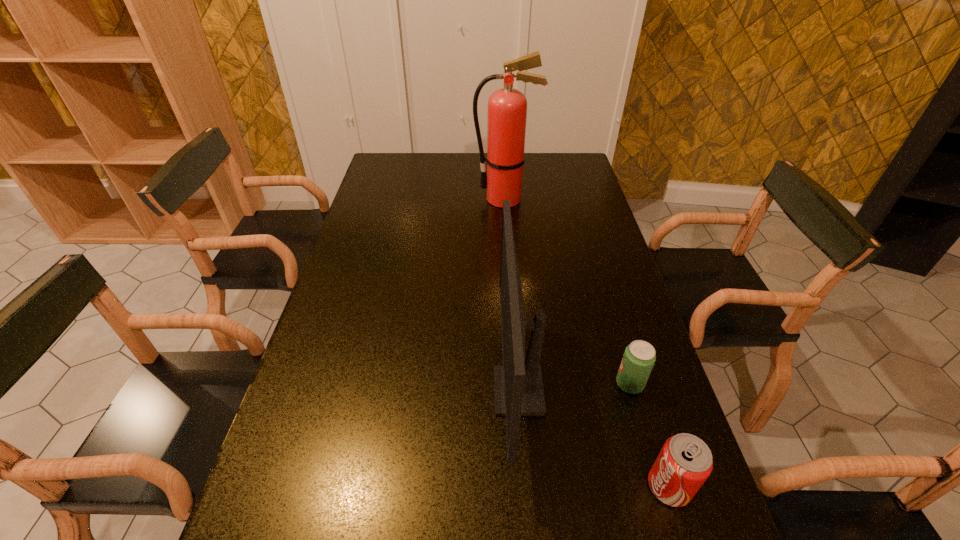
At what (x,y) coordinates should I click in order to perform the action: click on vacant space located on the front-facing side of the second tallest object. Please return your answer as a coordinate pair (x, y). This screenshot has width=960, height=540. Looking at the image, I should click on (340, 391).

Locate an element on the screen. vacant space located 0.170m on the front-facing side of the second tallest object is located at coordinates (421, 391).

In order to click on vacant space located on the back of the nearer soda in this screenshot , I will do tap(644, 404).

You are a GUI agent. You are given a task and a screenshot of the screen. Output one action in this format:
    pyautogui.click(x=<x>, y=<y>)
    Task: Click on the vacant space located 0.100m on the front of the shorter soda
    The image size is (960, 540).
    Given the screenshot: What is the action you would take?
    pyautogui.click(x=645, y=437)

In the image, there is a desktop. Where is `vacant space at the far edge`? vacant space at the far edge is located at coordinates (529, 159).

Locate an element on the screen. The width and height of the screenshot is (960, 540). vacant space at the left edge of the desktop is located at coordinates (372, 184).

At what (x,y) coordinates should I click in order to perform the action: click on vacant space at the right edge of the desktop. Please return your answer as a coordinate pair (x, y). This screenshot has height=540, width=960. Looking at the image, I should click on (647, 427).

I want to click on vacant space at the far left corner of the desktop, so click(375, 179).

This screenshot has width=960, height=540. Identify the location of free space at the far right corner of the desktop. click(565, 163).

You are a GUI agent. You are given a task and a screenshot of the screen. Output one action in this format:
    pyautogui.click(x=<x>, y=<y>)
    Task: Click on the free space that is in between the tallest object and the nearer soda
    The image size is (960, 540).
    Given the screenshot: What is the action you would take?
    pyautogui.click(x=588, y=342)